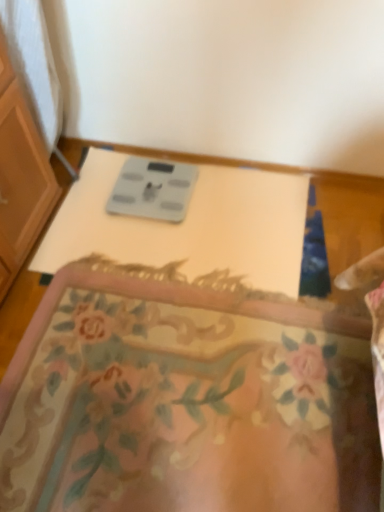
I want to click on empty space that is ontop of floral carpet at center (from a real-world perspective), so click(168, 382).